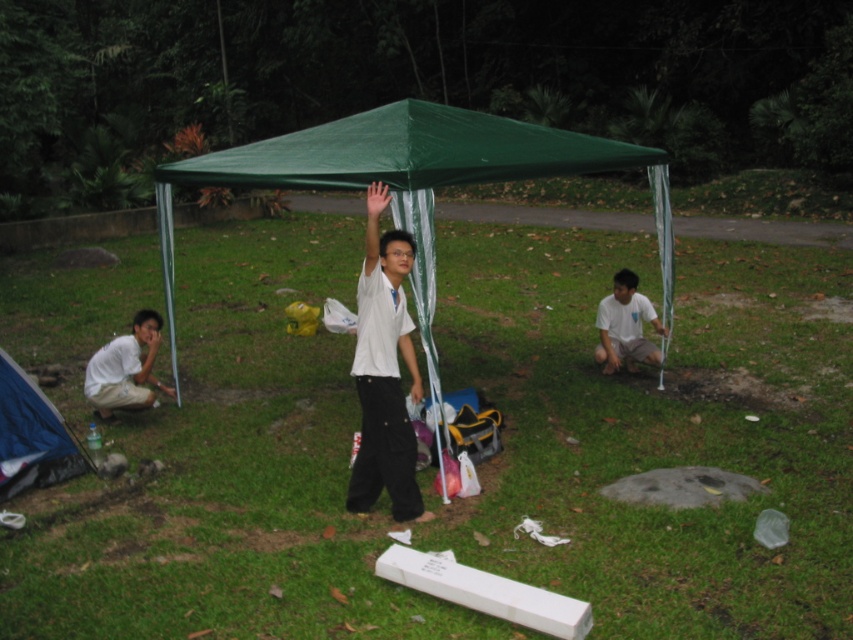
You are planning to set up a picnic blanket between the blue fabric tent at lower left and the white cotton shirt at lower right. The picnic blanket is 2 meters long. Will there be enough space to place it without overlapping either object?

The blue fabric tent at lower left is 4.68 meters away from the white cotton shirt at lower right. Since the picnic blanket is only 2 meters long, there is sufficient space to place it between them without overlapping either object.

You are organizing a picnic and need to decide which item to pack first. Based on their sizes, which item should you choose between the blue fabric tent at lower left and the white cotton shirt at lower right?

The blue fabric tent at lower left has a smaller size compared to the white cotton shirt at lower right, so you should pack the blue fabric tent at lower left first since it takes up less space.